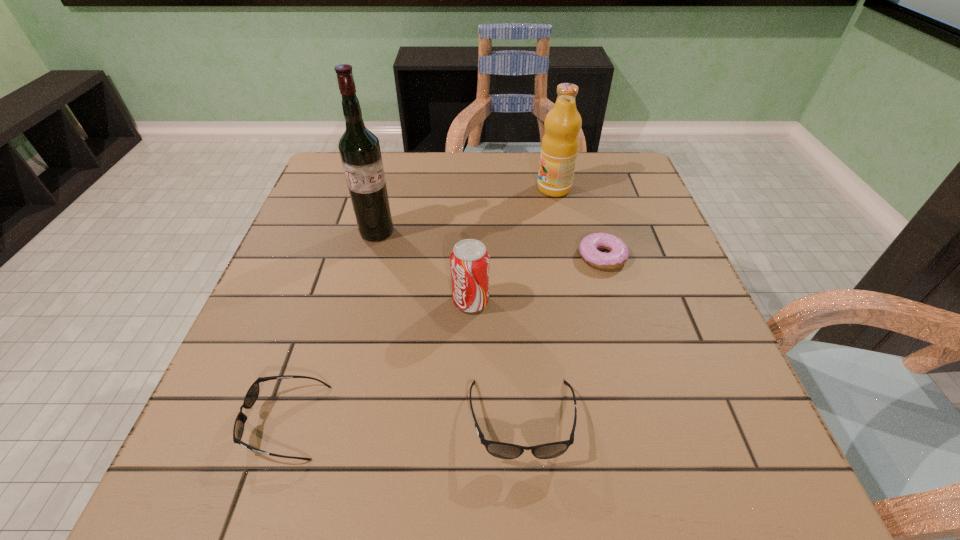
Find the location of a particular element. The width and height of the screenshot is (960, 540). the fifth tallest object is located at coordinates 252,394.

The image size is (960, 540). I want to click on the left sunglasses, so click(x=252, y=394).

This screenshot has width=960, height=540. I want to click on the taller sunglasses, so click(x=501, y=450).

This screenshot has height=540, width=960. In order to click on the right sunglasses in this screenshot , I will do `click(501, 450)`.

Find the location of a particular element. The image size is (960, 540). the tallest object is located at coordinates (359, 148).

Locate an element on the screen. the farthest object is located at coordinates (560, 143).

Where is `the fifth shortest object`? the fifth shortest object is located at coordinates (560, 143).

Where is `the third tallest object`? This screenshot has width=960, height=540. the third tallest object is located at coordinates (469, 260).

The width and height of the screenshot is (960, 540). Find the location of `soda can`. soda can is located at coordinates (469, 260).

Find the location of a particular element. doughnut is located at coordinates (x=618, y=254).